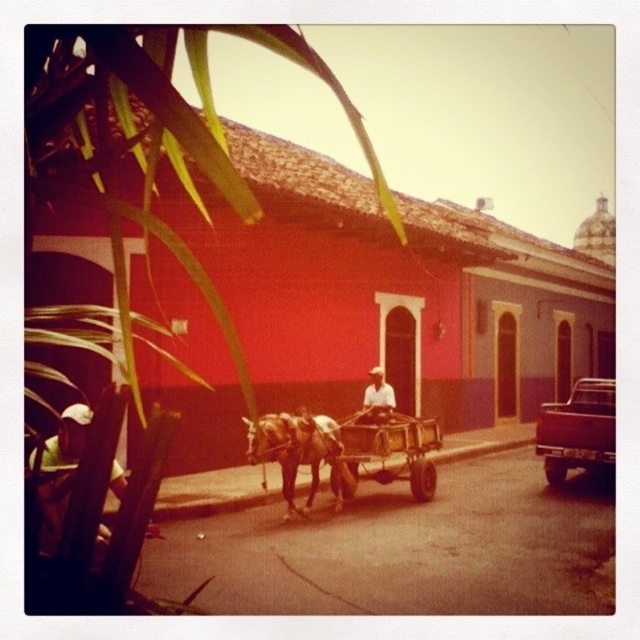
Is metallic brown pickup truck at right bigger than green fabric hat at lower left?

Correct, metallic brown pickup truck at right is larger in size than green fabric hat at lower left.

Is metallic brown pickup truck at right shorter than green fabric hat at lower left?

Incorrect, metallic brown pickup truck at right's height does not fall short of green fabric hat at lower left's.

Where is `metallic brown pickup truck at right`? metallic brown pickup truck at right is located at coordinates (577, 429).

Who is lower down, wooden cart at center or metallic brown pickup truck at right?

wooden cart at center is lower down.

Does wooden cart at center have a lesser height compared to metallic brown pickup truck at right?

Yes.

Between point (413, 433) and point (612, 464), which one is positioned in front?

Point (413, 433) is in front.

This screenshot has height=640, width=640. I want to click on wooden cart at center, so click(x=388, y=449).

Can you confirm if brown wooden cart at center is shorter than white clothed person at center?

Incorrect, brown wooden cart at center's height does not fall short of white clothed person at center's.

Does brown wooden cart at center appear on the left side of white clothed person at center?

Yes, brown wooden cart at center is to the left of white clothed person at center.

What do you see at coordinates (342, 451) in the screenshot?
I see `brown wooden cart at center` at bounding box center [342, 451].

The width and height of the screenshot is (640, 640). Identify the location of brown wooden cart at center. (342, 451).